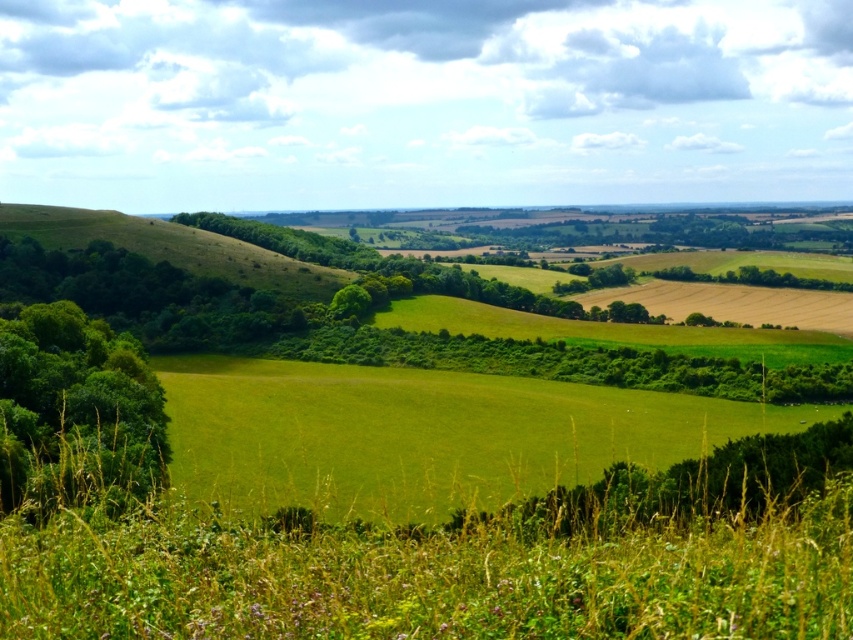
Question: Which object appears farthest from the camera in this image?

Choices:
 (A) green leafy tree at left
 (B) green grassy field at center

Answer: (A)

Question: Does green grassy field at center appear on the right side of green leafy tree at left?

Choices:
 (A) yes
 (B) no

Answer: (A)

Question: Which object appears farthest from the camera in this image?

Choices:
 (A) green grassy field at center
 (B) green leafy tree at left

Answer: (B)

Question: Is green grassy field at center above green leafy tree at left?

Choices:
 (A) yes
 (B) no

Answer: (B)

Question: Is green grassy field at center bigger than green leafy tree at left?

Choices:
 (A) no
 (B) yes

Answer: (B)